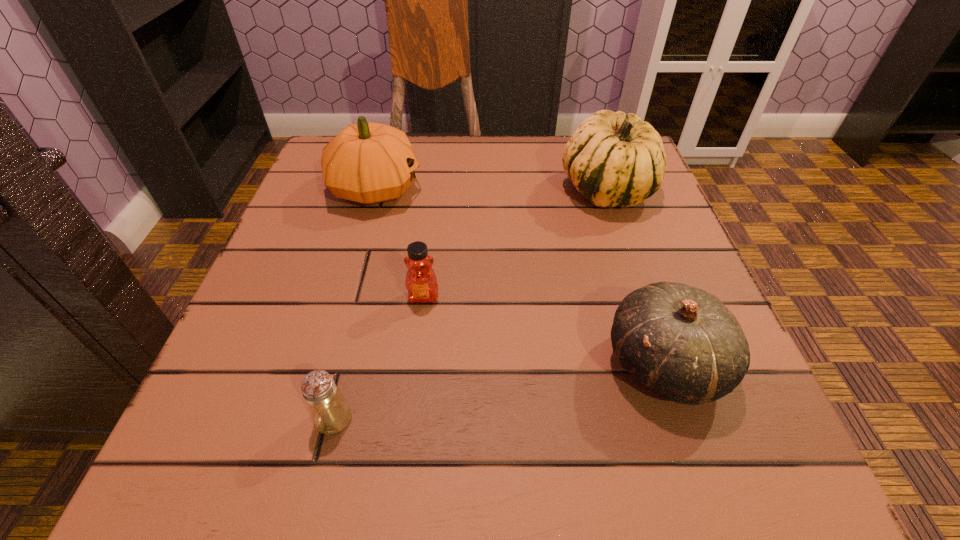
In the image, there is a desktop. Where is `blank space at the far left corner`? This screenshot has width=960, height=540. blank space at the far left corner is located at coordinates (324, 141).

What are the coordinates of `vacant area at the near left corner` in the screenshot? It's located at (197, 486).

In order to click on vacant area that lies between the leftmost gourd and the saltshaker in this screenshot , I will do (354, 304).

Locate an element on the screen. free space between the third farthest object and the third shortest object is located at coordinates (544, 330).

Locate an element on the screen. The image size is (960, 540). free spot between the saltshaker and the leftmost gourd is located at coordinates (354, 304).

Locate an element on the screen. This screenshot has height=540, width=960. vacant region between the third shortest object and the leftmost gourd is located at coordinates [x=520, y=276].

At what (x,y) coordinates should I click in order to perform the action: click on vacant space that's between the third object from right to left and the leftmost gourd. Please return your answer as a coordinate pair (x, y). This screenshot has width=960, height=540. Looking at the image, I should click on (399, 243).

The width and height of the screenshot is (960, 540). What are the coordinates of `free space between the nearest gourd and the leftmost gourd` in the screenshot? It's located at (520, 276).

At what (x,y) coordinates should I click in order to perform the action: click on unoccupied area between the third object from right to left and the shortest gourd. Please return your answer as a coordinate pair (x, y). Looking at the image, I should click on (544, 330).

What are the coordinates of `unoccupied area between the leftmost gourd and the shortest gourd` in the screenshot? It's located at (520, 276).